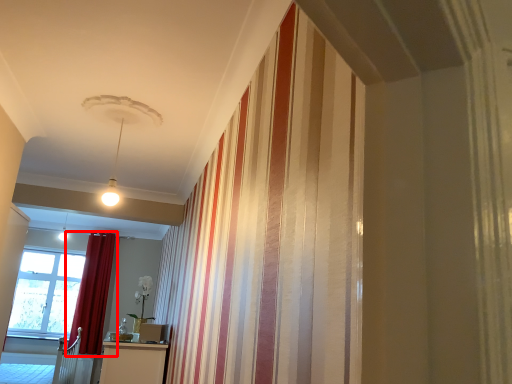
Question: From the image's perspective, considering the relative positions of curtain (annotated by the red box) and window in the image provided, where is curtain (annotated by the red box) located with respect to the staircase?

Choices:
 (A) below
 (B) above

Answer: (B)